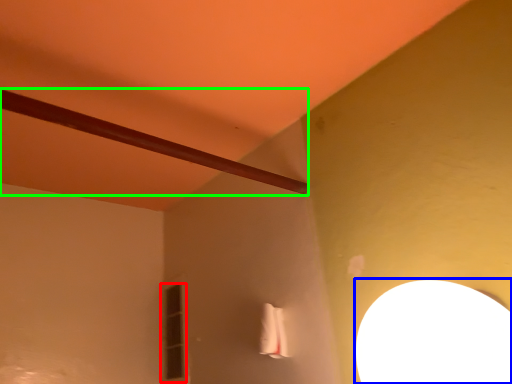
Question: Which is nearer to the window (highlighted by a red box)? lamp (highlighted by a blue box) or beam (highlighted by a green box).

Choices:
 (A) lamp
 (B) beam

Answer: (B)